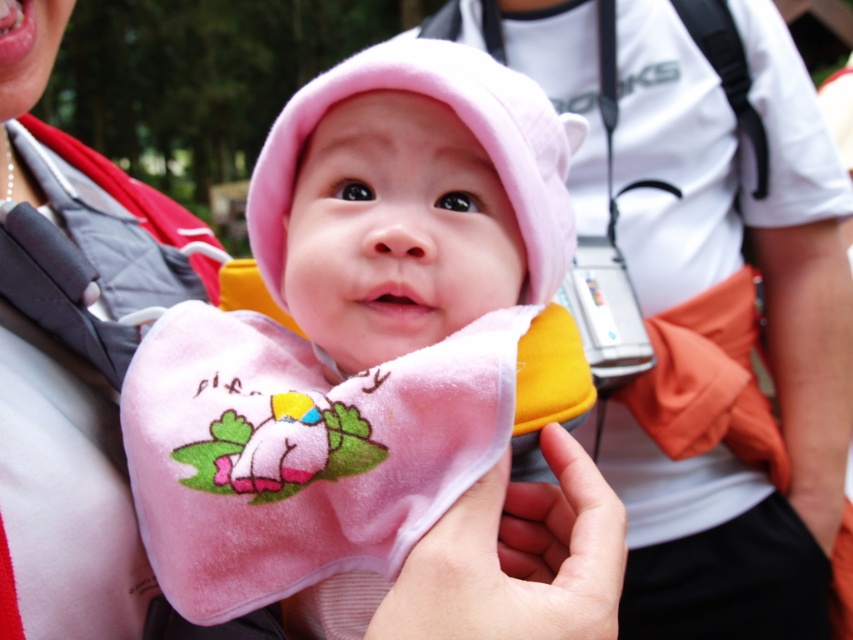
Is pink soft fabric baby at center wider than velvet pink bib at center?

Yes, pink soft fabric baby at center is wider than velvet pink bib at center.

The width and height of the screenshot is (853, 640). Describe the element at coordinates (355, 337) in the screenshot. I see `pink soft fabric baby at center` at that location.

You are a GUI agent. You are given a task and a screenshot of the screen. Output one action in this format:
    pyautogui.click(x=<x>, y=<y>)
    Task: Click on the pink soft fabric baby at center
    This screenshot has width=853, height=640.
    Given the screenshot: What is the action you would take?
    pyautogui.click(x=355, y=337)